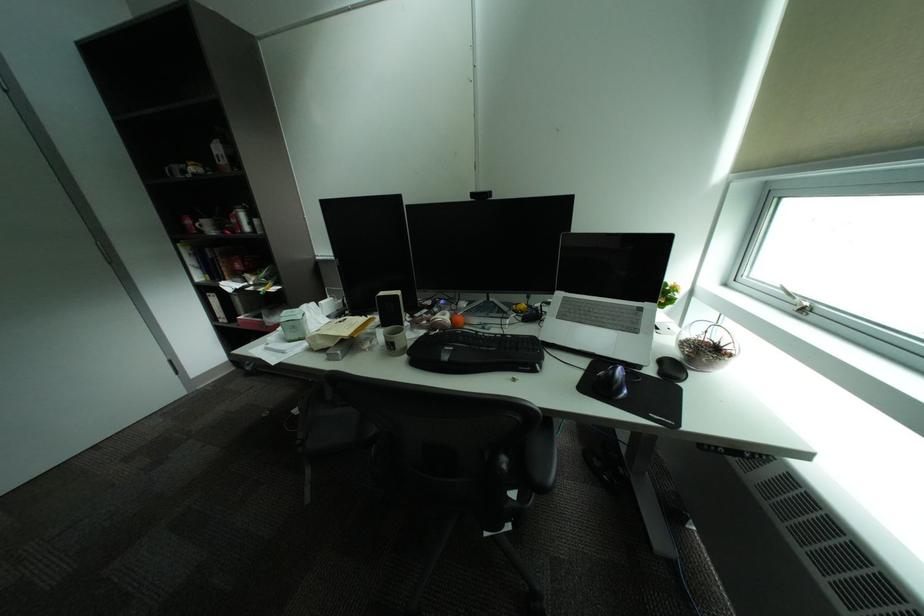
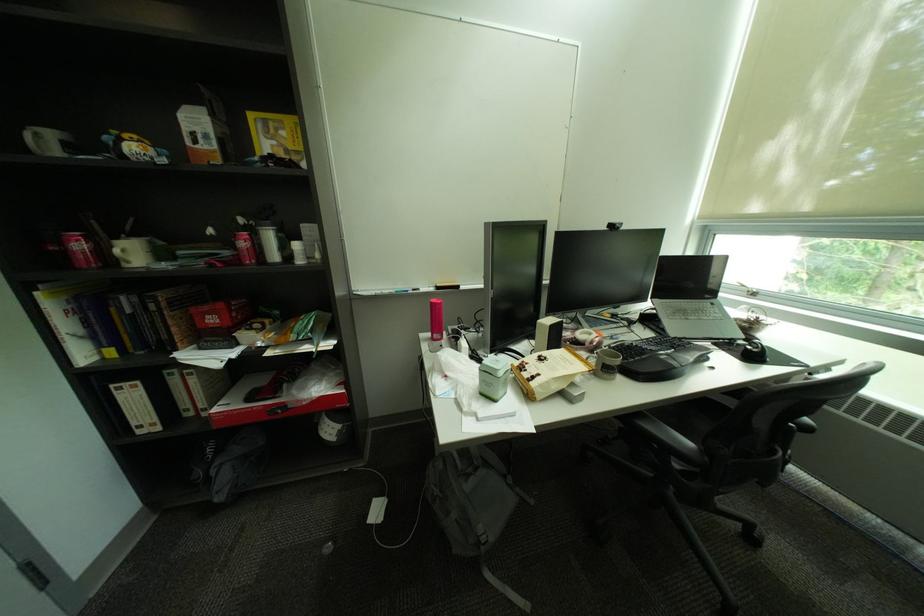
Locate, in the second image, the point that corresponds to point (199, 223) in the first image.

(91, 246)